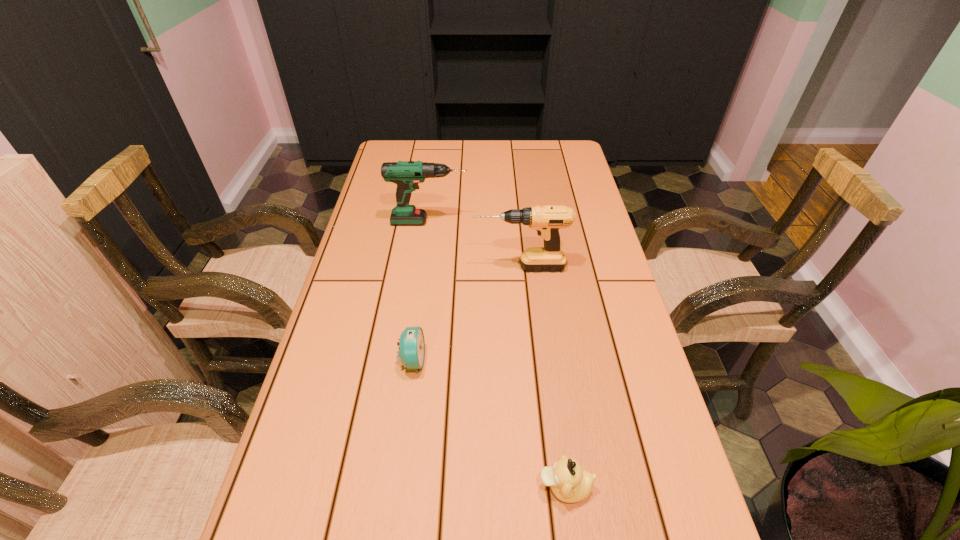
The image size is (960, 540). I want to click on the closest object to the third farthest object, so click(x=547, y=220).

What are the coordinates of `the third closest object relative to the nearest object` in the screenshot? It's located at (406, 174).